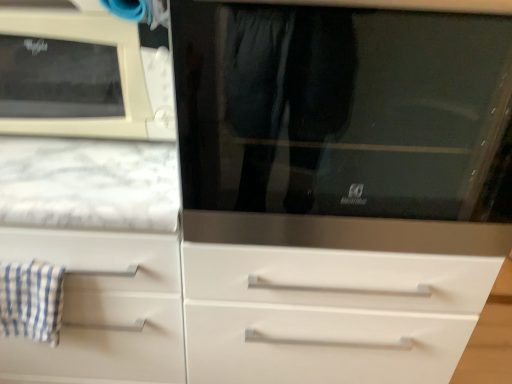
Find the location of a particular element. free space in front of beige plastic microwave at upper left is located at coordinates [x=81, y=175].